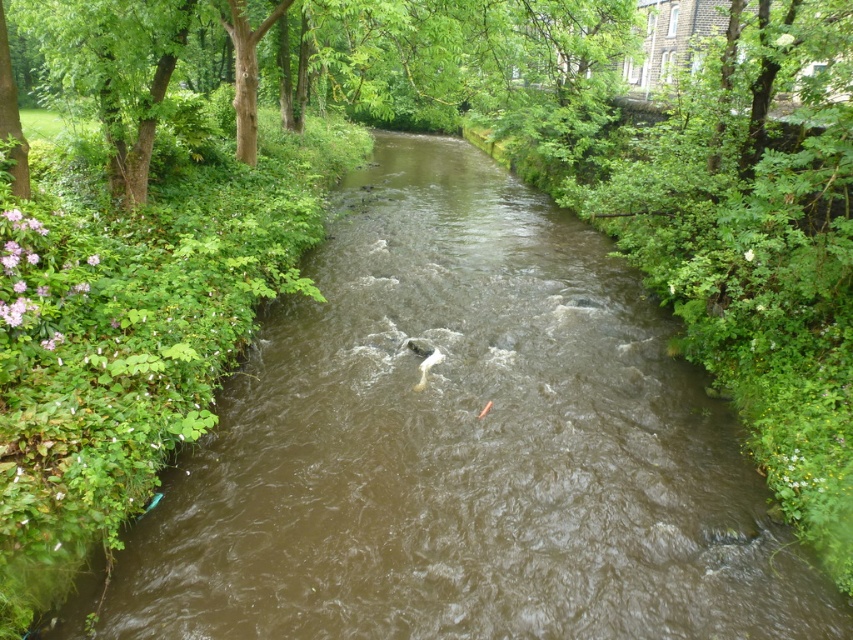
You are a kayaker planning to navigate the river shown in the image. You notice the green leafy tree at upper center and the white matte fish at center. Based on their distance, can you estimate how far apart these two landmarks are to help with your route planning?

The green leafy tree at upper center is 13.64 meters from the white matte fish at center, so the distance between them is approximately 13.64 meters.

You are an environmental scientist assessing the river ecosystem. You observe the green leafy tree at upper center and the white matte fish at center. Which object would cast a larger shadow on the river surface during midday? Explain your reasoning based on their sizes and positions.

The green leafy tree at upper center is larger in size than the white matte fish at center. Since the tree is bigger and positioned at the upper center, its shadow would be larger and more prominent on the river surface compared to the smaller fish at the center.

You are standing on the bank of the river and see the green leafy tree at upper center and the white matte fish at center. Which object is higher in the image?

The green leafy tree at upper center is above the white matte fish at center in the image.